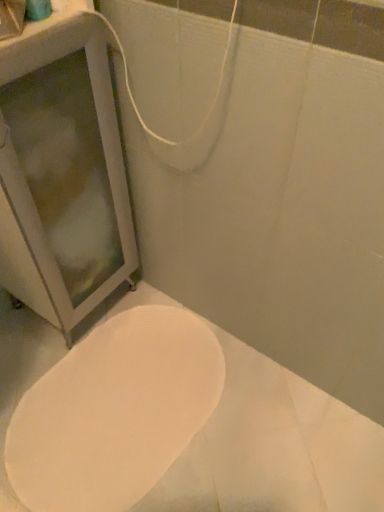
Where is `white glossy toilet seat at lower left`? The height and width of the screenshot is (512, 384). white glossy toilet seat at lower left is located at coordinates (114, 412).

Describe the element at coordinates (114, 412) in the screenshot. This screenshot has height=512, width=384. I see `white glossy toilet seat at lower left` at that location.

Locate an element on the screen. This screenshot has height=512, width=384. white glossy toilet seat at lower left is located at coordinates (114, 412).